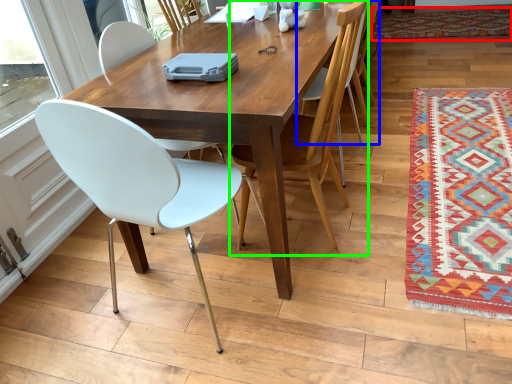
Question: Considering the real-world distances, which object is farthest from mat (highlighted by a red box)? chair (highlighted by a blue box) or chair (highlighted by a green box)?

Choices:
 (A) chair
 (B) chair

Answer: (B)